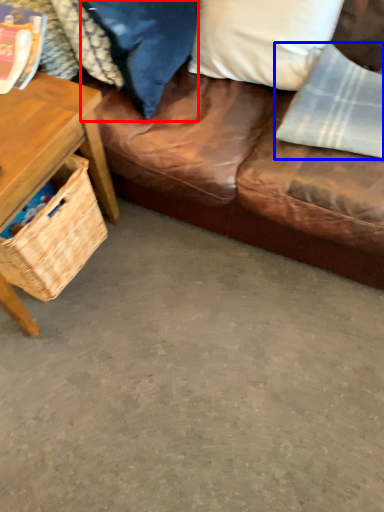
Question: Which object appears farthest to the camera in this image, pillow (highlighted by a red box) or material (highlighted by a blue box)?

Choices:
 (A) pillow
 (B) material

Answer: (B)